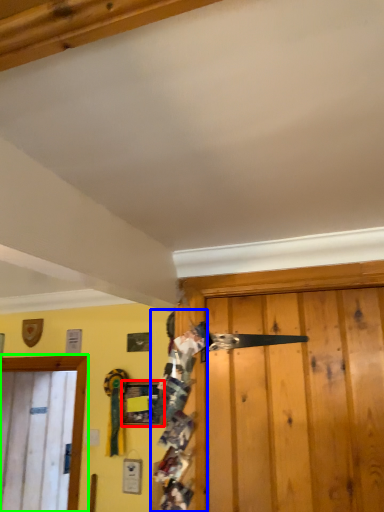
Question: Which object is positioned closest to picture frame (highlighted by a red box)? Select from person (highlighted by a blue box) and door (highlighted by a green box).

Choices:
 (A) person
 (B) door

Answer: (B)